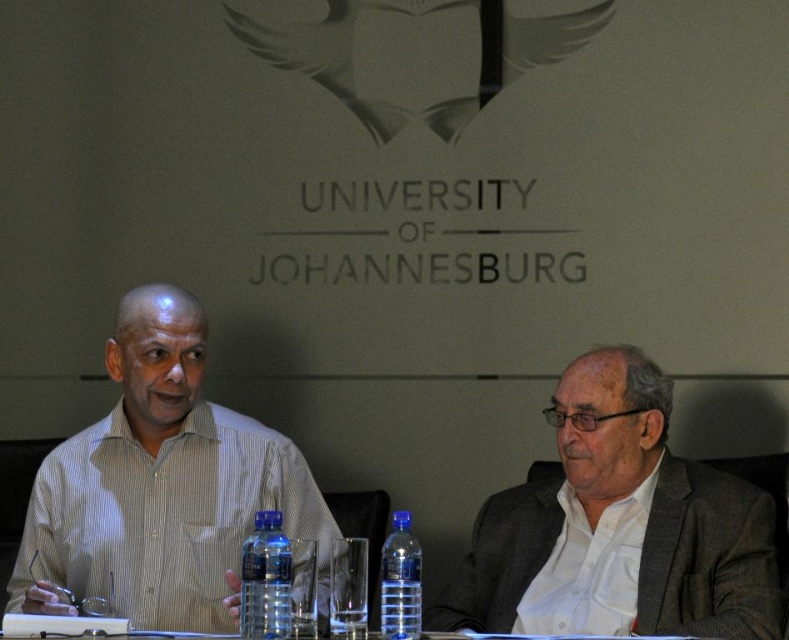
Which is in front, point (619, 348) or point (398, 595)?

Positioned in front is point (398, 595).

Image resolution: width=789 pixels, height=640 pixels. Find the location of `white textured shirt at center`. white textured shirt at center is located at coordinates (619, 528).

Identify the location of white striped shirt at center. (159, 486).

Can you confirm if white textured shirt at center is positioned above transparent plastic bottle at center?

Indeed, white textured shirt at center is positioned over transparent plastic bottle at center.

Between white textured shirt at center and transparent plastic bottle at center, which one appears on the right side from the viewer's perspective?

white textured shirt at center

Find the location of a particular element. The width and height of the screenshot is (789, 640). white textured shirt at center is located at coordinates (619, 528).